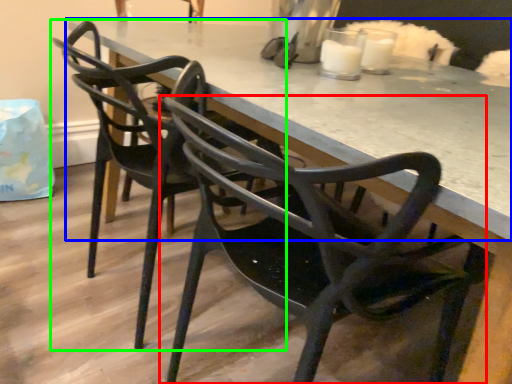
Question: Estimate the real-world distances between objects in this image. Which object is farther from chair (highlighted by a red box), table (highlighted by a blue box) or chair (highlighted by a green box)?

Choices:
 (A) table
 (B) chair

Answer: (B)